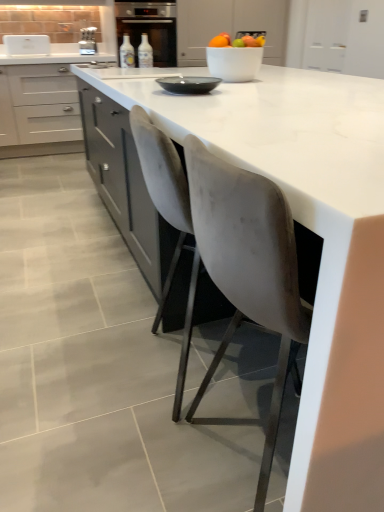
Question: From a real-world perspective, is translucent glass bottle at center, the first bottle viewed from the right, above or below metallic silver toaster at upper left?

Choices:
 (A) below
 (B) above

Answer: (A)

Question: From the image's perspective, relative to metallic silver toaster at upper left, is translucent glass bottle at center, the first bottle viewed from the right, above or below?

Choices:
 (A) above
 (B) below

Answer: (B)

Question: Which is nearer to the white marble countertop at center?

Choices:
 (A) velvet grey chair at center
 (B) translucent glass bottle at center, the second bottle from the right
 (C) matte black bowl at center
 (D) metallic silver toaster at upper left
 (E) translucent glass bottle at center, the first bottle viewed from the right

Answer: (A)

Question: Which is nearer to the velvet grey chair at center?

Choices:
 (A) matte black bowl at center
 (B) white marble countertop at center
 (C) metallic silver toaster at upper left
 (D) translucent glass bottle at center, which ranks as the second bottle in left-to-right order
 (E) matte gray cabinets at left

Answer: (B)